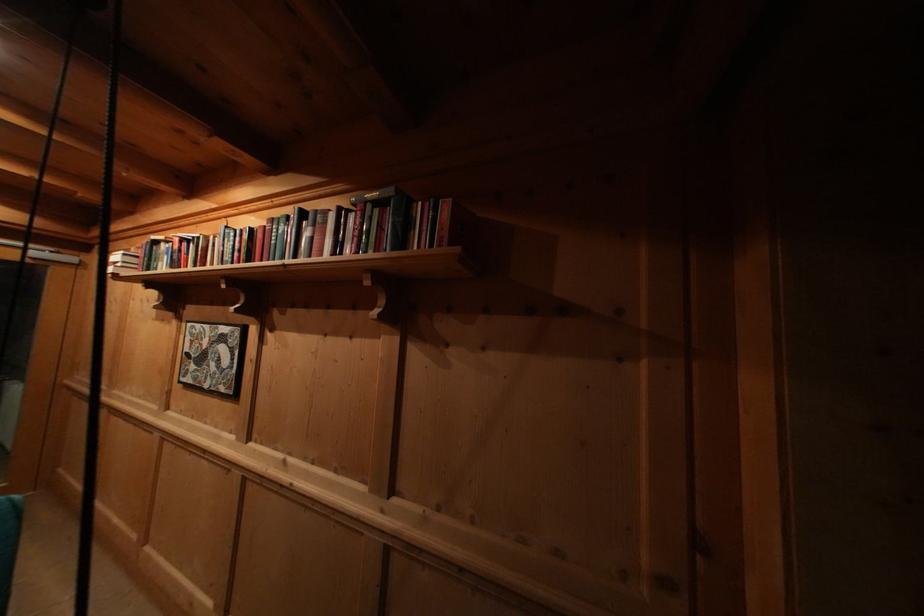
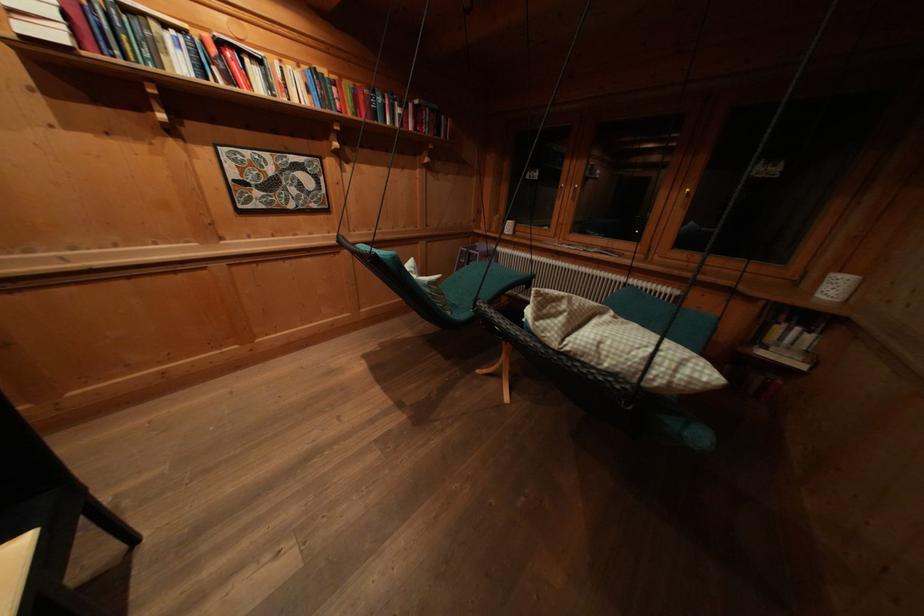
Where in the second image is the point corresponding to the point at 188,246 from the first image?

(225, 47)